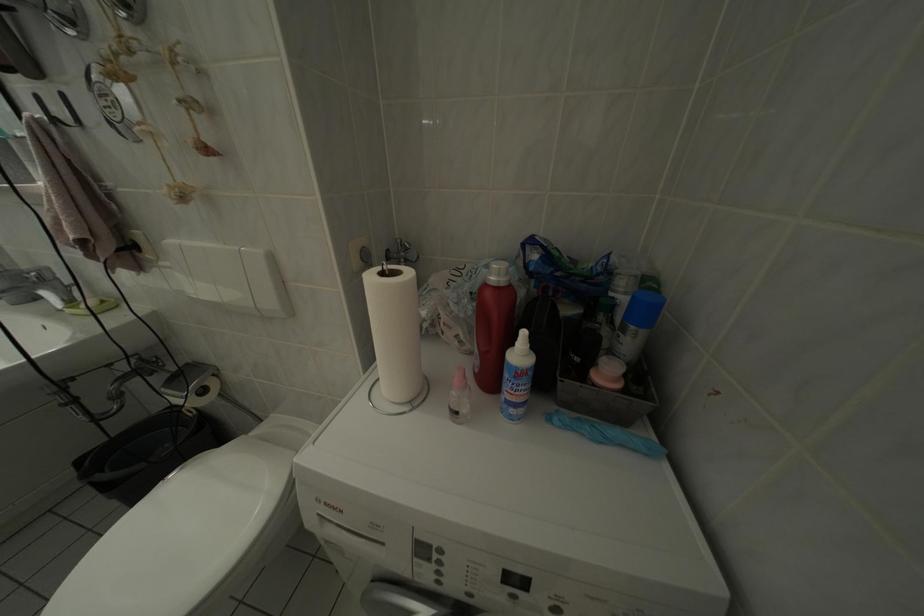
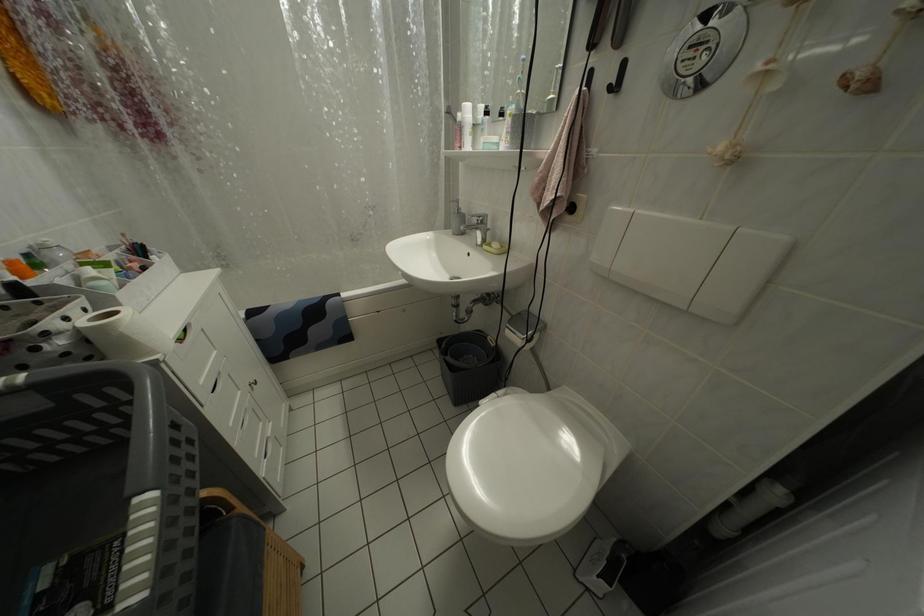
Question: The first image is from the beginning of the video and the second image is from the end. How did the camera likely rotate when shooting the video?

Choices:
 (A) Left
 (B) Right
 (C) Up
 (D) Down

Answer: (A)